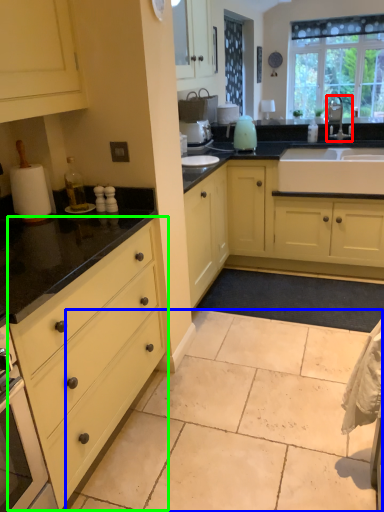
Question: Which is nearer to the tap (highlighted by a red box)? granite (highlighted by a blue box) or drawer (highlighted by a green box).

Choices:
 (A) granite
 (B) drawer

Answer: (A)